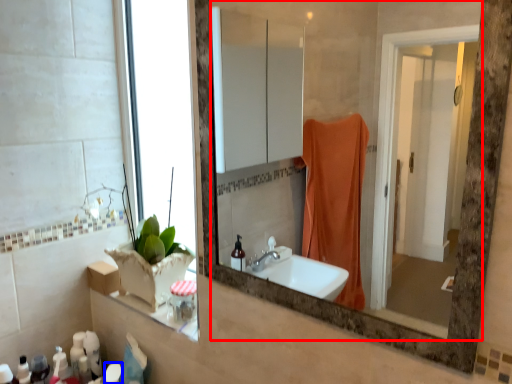
Question: Which object appears closest to the camera in this image, mirror (highlighted by a red box) or toiletry (highlighted by a blue box)?

Choices:
 (A) mirror
 (B) toiletry

Answer: (A)